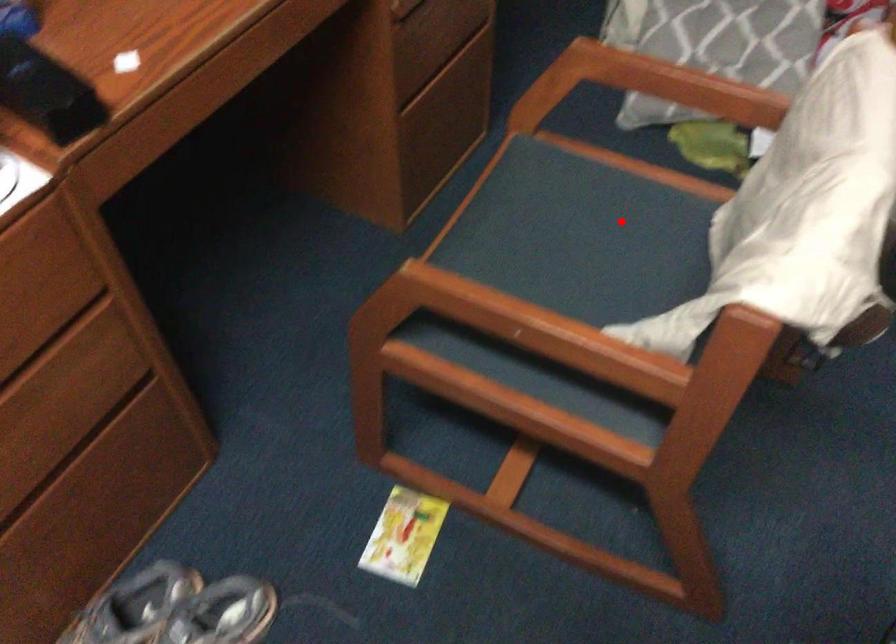
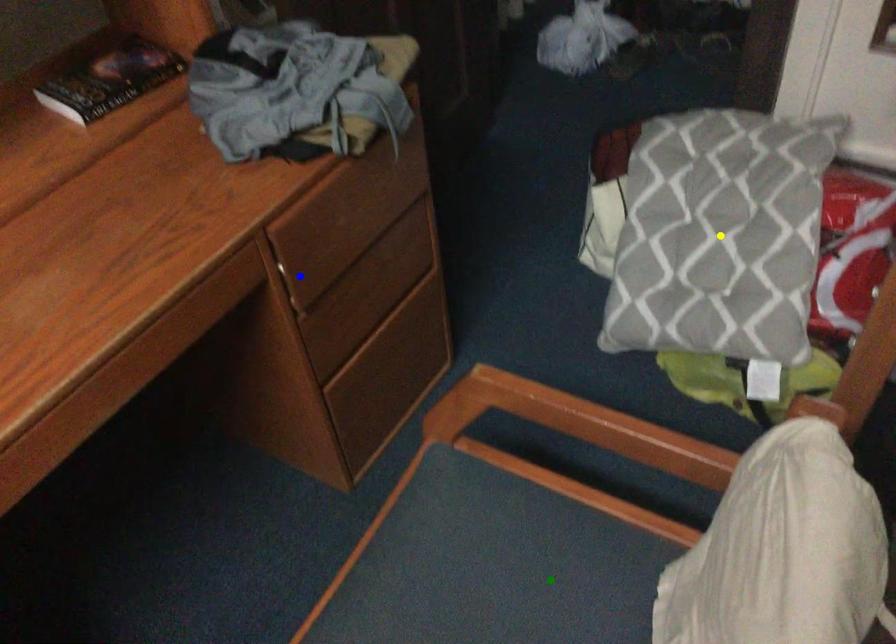
Question: I am providing you with two images of the same scene from different viewpoints. A red point is marked on the first image. You are given multiple points on the second image. In image 2, which mark is for the same physical point as the one in image 1?

Choices:
 (A) blue point
 (B) yellow point
 (C) green point

Answer: (C)